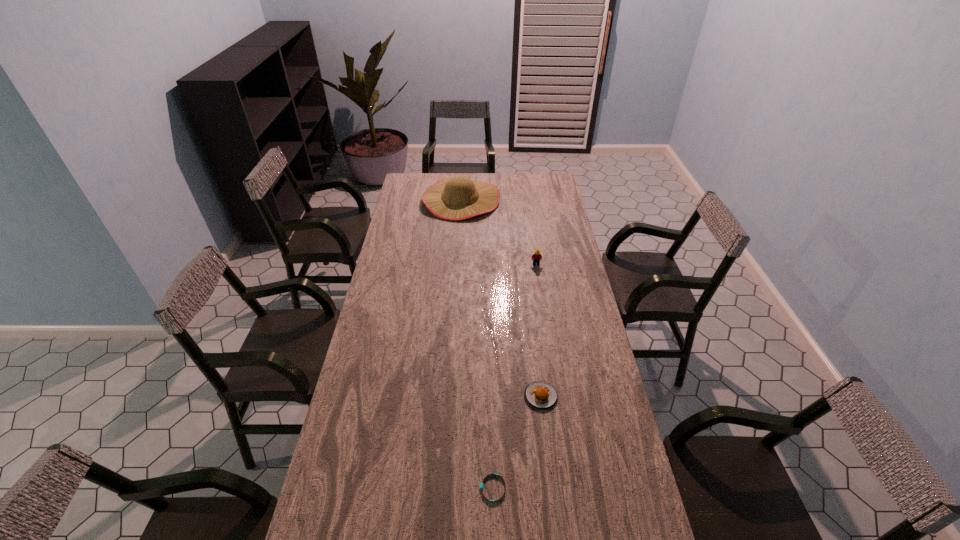
The width and height of the screenshot is (960, 540). In order to click on blank space located on the left of the third tallest object in this screenshot , I will do `click(412, 396)`.

Locate an element on the screen. The image size is (960, 540). free space located on the buckle of the wristband is located at coordinates (382, 489).

At what (x,y) coordinates should I click in order to perform the action: click on free spot located 0.210m on the buckle of the wristband. Please return your answer as a coordinate pair (x, y). The image size is (960, 540). Looking at the image, I should click on (406, 489).

Where is `free space located on the buckle of the wristband`? free space located on the buckle of the wristband is located at coordinates (354, 489).

What are the coordinates of `object that is at the far edge` in the screenshot? It's located at (458, 198).

Locate an element on the screen. Image resolution: width=960 pixels, height=540 pixels. object at the left edge is located at coordinates (458, 198).

Locate an element on the screen. object that is at the far left corner is located at coordinates (458, 198).

Locate an element on the screen. The height and width of the screenshot is (540, 960). blank area at the far edge is located at coordinates (502, 178).

Find the location of a particular element. The image size is (960, 540). free space at the left edge of the desktop is located at coordinates (375, 373).

This screenshot has height=540, width=960. In the image, there is a desktop. Find the location of `vacant space at the right edge`. vacant space at the right edge is located at coordinates (x=564, y=278).